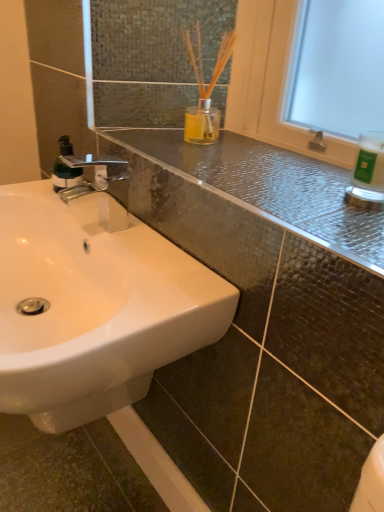
Question: Should I look upward or downward to see white glossy sink at lower left?

Choices:
 (A) up
 (B) down

Answer: (B)

Question: Is white glossy sink at lower left bigger than green matte bottle at left?

Choices:
 (A) yes
 (B) no

Answer: (A)

Question: From a real-world perspective, is white glossy sink at lower left on top of green matte bottle at left?

Choices:
 (A) no
 (B) yes

Answer: (A)

Question: Is white glossy sink at lower left at the right side of green matte bottle at left?

Choices:
 (A) yes
 (B) no

Answer: (A)

Question: Is the depth of white glossy sink at lower left greater than that of green matte bottle at left?

Choices:
 (A) yes
 (B) no

Answer: (B)

Question: Does white glossy sink at lower left have a lesser width compared to green matte bottle at left?

Choices:
 (A) yes
 (B) no

Answer: (B)

Question: Is white glossy sink at lower left taller than green matte bottle at left?

Choices:
 (A) no
 (B) yes

Answer: (B)

Question: From a real-world perspective, is glossy ceramic counter top at upper center physically above green matte bottle at left?

Choices:
 (A) no
 (B) yes

Answer: (B)

Question: Is glossy ceramic counter top at upper center shorter than green matte bottle at left?

Choices:
 (A) yes
 (B) no

Answer: (A)

Question: Is glossy ceramic counter top at upper center positioned in front of green matte bottle at left?

Choices:
 (A) no
 (B) yes

Answer: (B)

Question: Can you confirm if glossy ceramic counter top at upper center is smaller than green matte bottle at left?

Choices:
 (A) no
 (B) yes

Answer: (A)

Question: Does glossy ceramic counter top at upper center appear on the right side of green matte bottle at left?

Choices:
 (A) no
 (B) yes

Answer: (B)

Question: Is glossy ceramic counter top at upper center placed right next to green matte bottle at left?

Choices:
 (A) no
 (B) yes

Answer: (A)

Question: Can you confirm if white glossy sink at lower left is bigger than white glossy bottle at upper right?

Choices:
 (A) no
 (B) yes

Answer: (B)